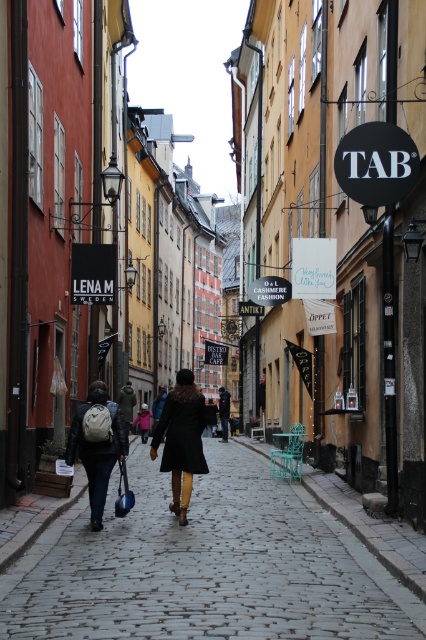
You are a delivery person with a 6 feet long package. You need to walk through the cobblestone street while carrying the package. There is a matte black coat at center and a matte black backpack at center. Can you pass between them without needing to tilt the package?

The distance between the matte black coat at center and the matte black backpack at center is 6.36 feet, which is slightly longer than the 6 feet package. Therefore, you can pass between them without tilting the package.

You are a delivery person trying to reach a package on the ground. You see a matte black coat at center and a matte black backpack at center. Which object is closer to you?

The matte black backpack at center is closer to you because the matte black coat at center is positioned over it, indicating the backpack is beneath the coat.

You are standing on the cobblestone street and want to walk towards the point that is closer to you. Which point should you walk towards, point (256, 529) or point (172, 401)?

You should walk towards point (256, 529) because it is closer to the viewer than point (172, 401).